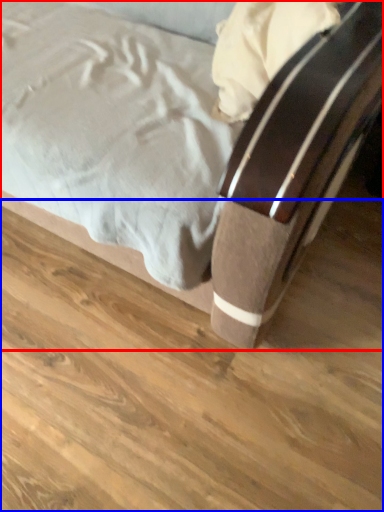
Question: Which of the following is the closest to the observer, bed (highlighted by a red box) or plank (highlighted by a blue box)?

Choices:
 (A) bed
 (B) plank

Answer: (A)